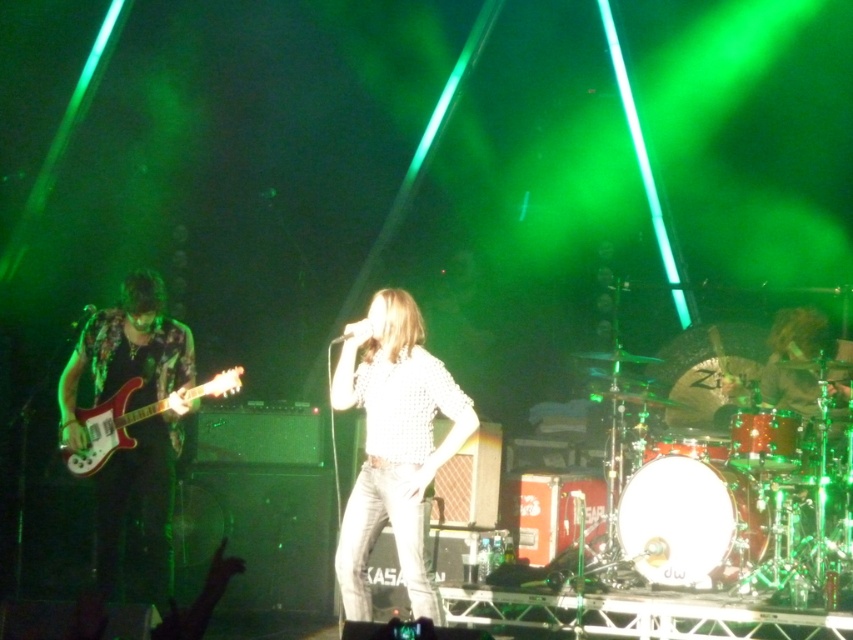
Looking at this image, who is more distant from viewer, (96,385) or (842,380)?

The point (842,380) is more distant.

Does point (106, 316) come closer to viewer compared to point (807, 419)?

Yes, it is in front of point (807, 419).

This screenshot has height=640, width=853. In order to click on shiny metallic guitar at left in this screenshot , I will do `click(134, 426)`.

Does shiny metallic guitar at left have a lesser height compared to shiny red electric guitar at left?

Incorrect, shiny metallic guitar at left's height does not fall short of shiny red electric guitar at left's.

Does shiny metallic guitar at left have a smaller size compared to shiny red electric guitar at left?

No.

Where is `shiny metallic guitar at left`? shiny metallic guitar at left is located at coordinates (134, 426).

Is white textured shirt at center thinner than shiny red electric guitar at left?

Correct, white textured shirt at center's width is less than shiny red electric guitar at left's.

Who is taller, white textured shirt at center or shiny red electric guitar at left?

Standing taller between the two is white textured shirt at center.

Does point (421, 570) come in front of point (86, 468)?

Yes, point (421, 570) is closer to viewer.

At what (x,y) coordinates should I click in order to perform the action: click on white textured shirt at center. Please return your answer as a coordinate pair (x, y). This screenshot has height=640, width=853. Looking at the image, I should click on (393, 445).